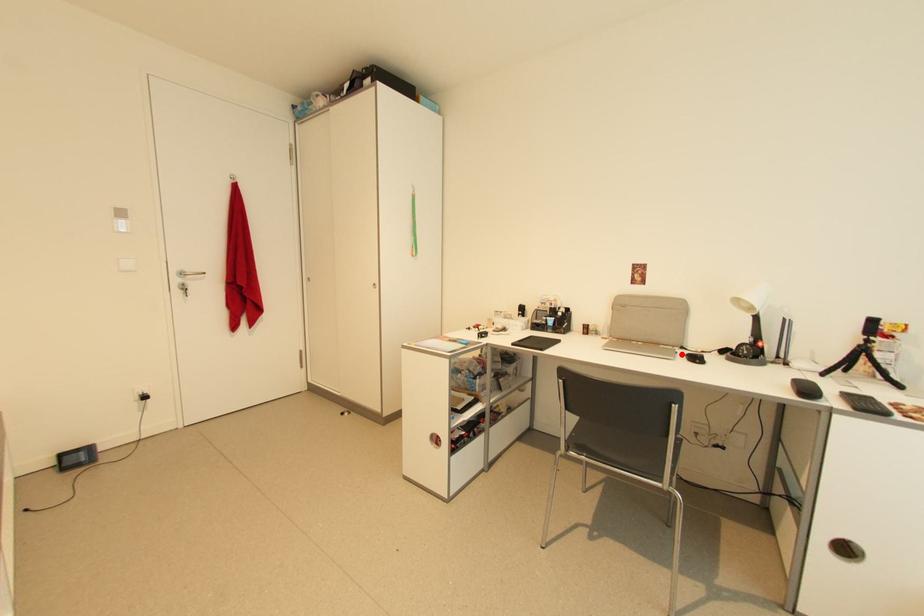
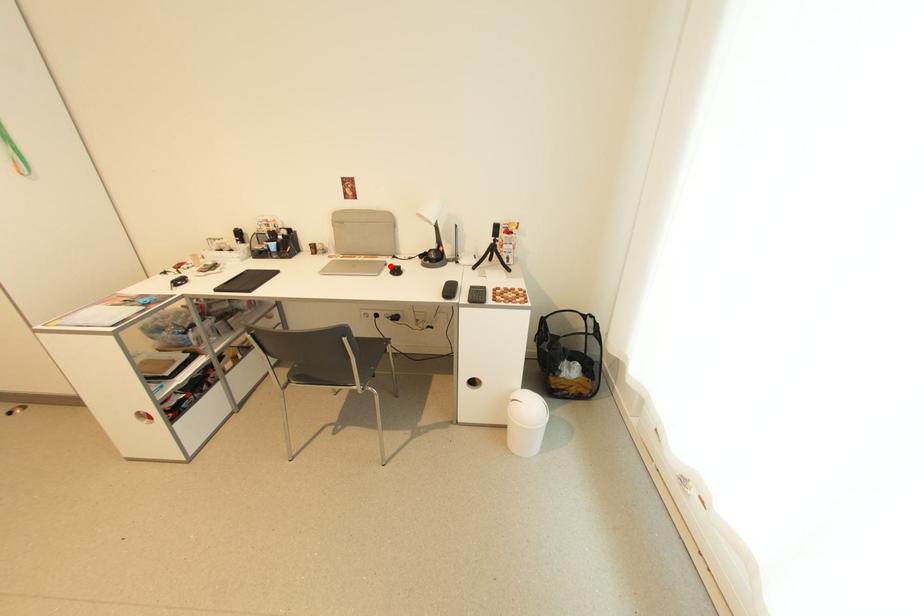
I am providing you with two images of the same scene from different viewpoints. A red point is marked on the first image and another point is marked on the second image. Do the highlighted points in image1 and image2 indicate the same real-world spot?

Yes